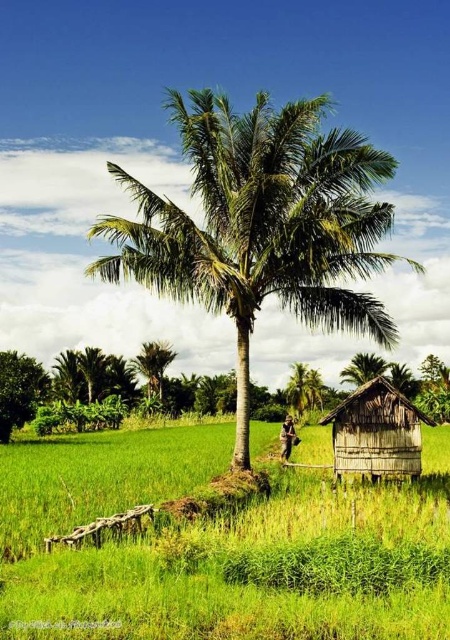
Question: Does green leafy coconut tree at center have a lesser width compared to wooden hut at lower right?

Choices:
 (A) no
 (B) yes

Answer: (A)

Question: Does green grassy rice field at lower left have a greater width compared to wooden hut at lower right?

Choices:
 (A) yes
 (B) no

Answer: (A)

Question: Which of the following is the closest to the observer?

Choices:
 (A) wooden hut at lower right
 (B) green grassy rice field at lower left

Answer: (B)

Question: Among these objects, which one is nearest to the camera?

Choices:
 (A) green leafy tree at lower left
 (B) green grassy rice field at lower left
 (C) green leafy coconut tree at center

Answer: (B)

Question: Considering the relative positions of green leafy coconut tree at center and wooden hut at lower right in the image provided, where is green leafy coconut tree at center located with respect to wooden hut at lower right?

Choices:
 (A) above
 (B) below

Answer: (A)

Question: Among these points, which one is nearest to the camera?

Choices:
 (A) (358, 428)
 (B) (219, 609)
 (C) (0, 394)
 (D) (410, 262)

Answer: (B)